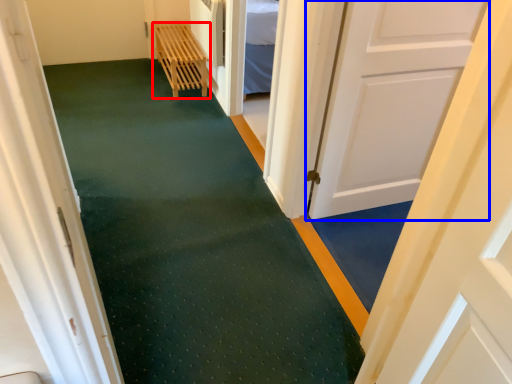
Question: Which point is closer to the camera, furniture (highlighted by a red box) or door (highlighted by a blue box)?

Choices:
 (A) furniture
 (B) door

Answer: (B)